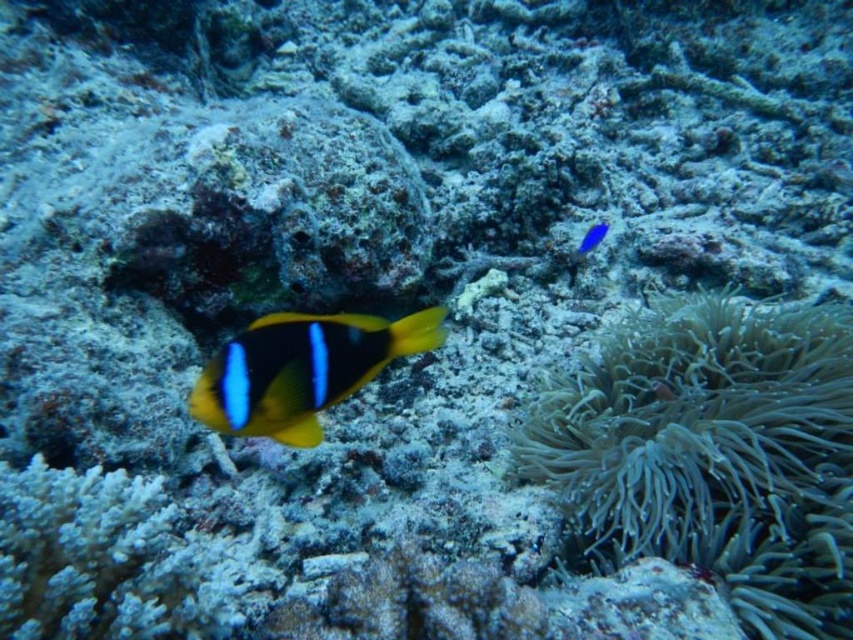
Question: Does soft gray coral at lower right lie in front of glossy blue fish at upper right?

Choices:
 (A) no
 (B) yes

Answer: (B)

Question: Where is soft gray coral at lower right located in relation to yellow matte clownfish at center in the image?

Choices:
 (A) left
 (B) right

Answer: (B)

Question: Which point is farther to the camera?

Choices:
 (A) soft gray coral at lower right
 (B) glossy blue fish at upper right
 (C) yellow matte clownfish at center

Answer: (B)

Question: Which of the following is the farthest from the observer?

Choices:
 (A) glossy blue fish at upper right
 (B) yellow matte clownfish at center

Answer: (A)

Question: Can you confirm if soft gray coral at lower right is bigger than yellow matte clownfish at center?

Choices:
 (A) yes
 (B) no

Answer: (A)

Question: Among these objects, which one is farthest from the camera?

Choices:
 (A) yellow matte clownfish at center
 (B) soft gray coral at lower right
 (C) glossy blue fish at upper right

Answer: (C)